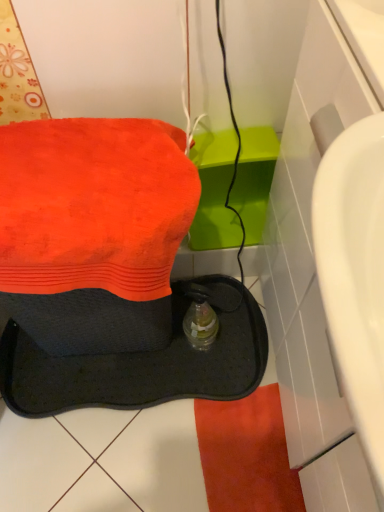
Locate an element on the screen. free location above orange terry towel at upper left (from a real-world perspective) is located at coordinates (79, 176).